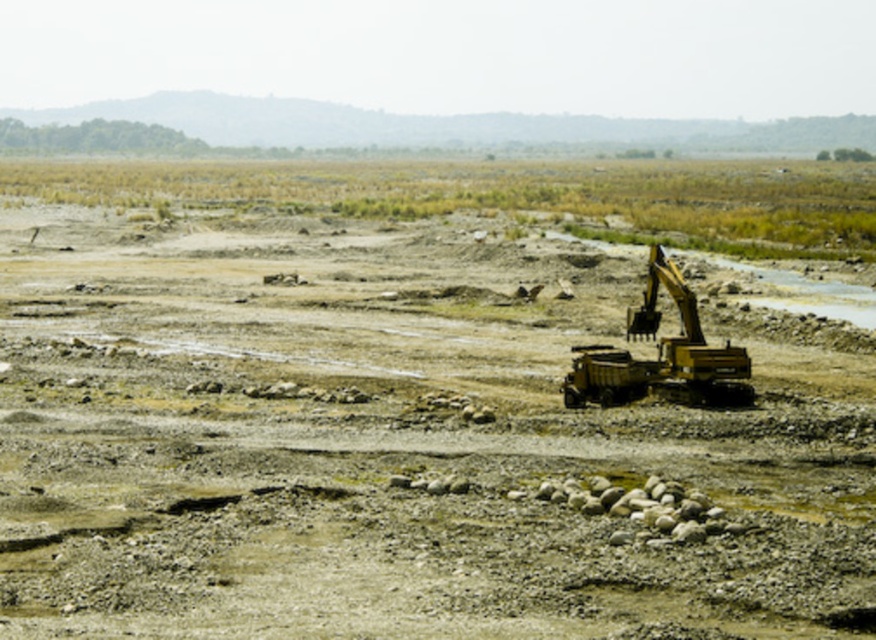
Question: Can you confirm if yellow metallic excavator at right is wider than yellow metallic excavator at center-right?

Choices:
 (A) yes
 (B) no

Answer: (A)

Question: Does yellow metallic excavator at right have a greater width compared to yellow metallic excavator at center-right?

Choices:
 (A) no
 (B) yes

Answer: (B)

Question: Does yellow metallic excavator at right lie behind yellow metallic excavator at center-right?

Choices:
 (A) yes
 (B) no

Answer: (B)

Question: Among these points, which one is nearest to the camera?

Choices:
 (A) (597, 385)
 (B) (309, 545)

Answer: (B)

Question: Which point is closer to the camera?

Choices:
 (A) (824, 452)
 (B) (618, 404)

Answer: (A)